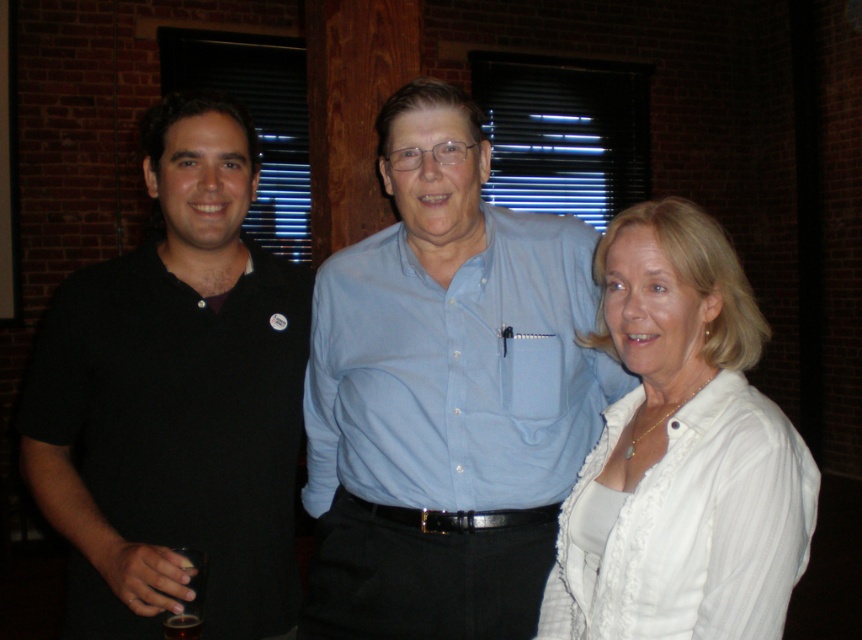
Question: Considering the relative positions of white lace shirt at center and light blue button-up shirt at center in the image provided, where is white lace shirt at center located with respect to light blue button-up shirt at center?

Choices:
 (A) right
 (B) left

Answer: (A)

Question: Among these objects, which one is nearest to the camera?

Choices:
 (A) white lace shirt at center
 (B) black matte shirt at left
 (C) light blue button-up shirt at center

Answer: (A)

Question: From the image, what is the correct spatial relationship of white lace shirt at center in relation to light blue button-up shirt at center?

Choices:
 (A) right
 (B) left

Answer: (A)

Question: Which of the following is the farthest from the observer?

Choices:
 (A) black matte shirt at left
 (B) white lace shirt at center
 (C) light blue button-up shirt at center

Answer: (C)

Question: Which of the following is the closest to the observer?

Choices:
 (A) black matte shirt at left
 (B) white lace shirt at center

Answer: (B)

Question: Is white lace shirt at center smaller than light blue button-up shirt at center?

Choices:
 (A) yes
 (B) no

Answer: (A)